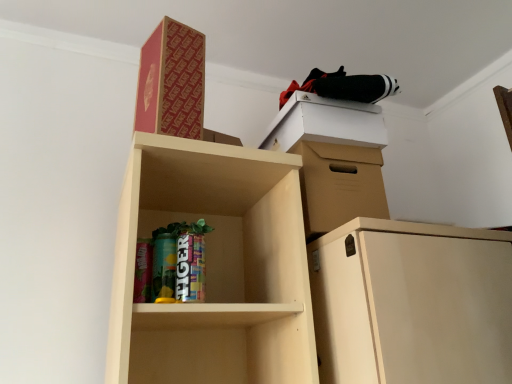
Identify the location of red cardboard box at upper center. (172, 82).

Describe the element at coordinates (172, 82) in the screenshot. The width and height of the screenshot is (512, 384). I see `red cardboard box at upper center` at that location.

You are a GUI agent. You are given a task and a screenshot of the screen. Output one action in this format:
    pyautogui.click(x=<x>, y=<y>)
    Task: Click on the white cardboard box at upper right
    
    Given the screenshot: What is the action you would take?
    pyautogui.click(x=333, y=158)

The image size is (512, 384). Describe the element at coordinates (333, 158) in the screenshot. I see `white cardboard box at upper right` at that location.

Where is `red cardboard box at upper center`? red cardboard box at upper center is located at coordinates (172, 82).

Can you confirm if red cardboard box at upper center is positioned to the right of white cardboard box at upper right?

No, red cardboard box at upper center is not to the right of white cardboard box at upper right.

In the image, is red cardboard box at upper center positioned in front of or behind white cardboard box at upper right?

Clearly, red cardboard box at upper center is in front of white cardboard box at upper right.

Is point (137, 105) positioned before point (300, 95)?

That is True.

From the image's perspective, does red cardboard box at upper center appear lower than white cardboard box at upper right?

Actually, red cardboard box at upper center appears above white cardboard box at upper right in the image.

Based on the photo, from a real-world perspective, is red cardboard box at upper center under white cardboard box at upper right?

No.

Which object is wider, red cardboard box at upper center or white cardboard box at upper right?

white cardboard box at upper right.

Who is shorter, red cardboard box at upper center or white cardboard box at upper right?

white cardboard box at upper right.

Based on the photo, in terms of size, does red cardboard box at upper center appear bigger or smaller than white cardboard box at upper right?

red cardboard box at upper center is smaller than white cardboard box at upper right.

Is red cardboard box at upper center inside or outside of white cardboard box at upper right?

red cardboard box at upper center is not inside white cardboard box at upper right, it's outside.

Is red cardboard box at upper center beside white cardboard box at upper right?

red cardboard box at upper center and white cardboard box at upper right are clearly separated.

Is red cardboard box at upper center looking in the opposite direction of white cardboard box at upper right?

That's not correct — red cardboard box at upper center is not looking away from white cardboard box at upper right.

Where is `paperback book above the white cardboard box at upper right (from a real-world perspective)`? paperback book above the white cardboard box at upper right (from a real-world perspective) is located at coordinates (172, 82).

Based on their positions, is white cardboard box at upper right located to the left or right of red cardboard box at upper center?

white cardboard box at upper right is to the right of red cardboard box at upper center.

Considering their positions, is white cardboard box at upper right located in front of or behind red cardboard box at upper center?

Clearly, white cardboard box at upper right is behind red cardboard box at upper center.

Which is behind, point (376, 202) or point (173, 96)?

The point (376, 202) is more distant.

From the image's perspective, would you say white cardboard box at upper right is shown under red cardboard box at upper center?

Yes.

From a real-world perspective, between white cardboard box at upper right and red cardboard box at upper center, who is vertically higher?

In real-world perspective, red cardboard box at upper center is above.

Which object is thinner, white cardboard box at upper right or red cardboard box at upper center?

Thinner between the two is red cardboard box at upper center.

From the picture: Does white cardboard box at upper right have a greater height compared to red cardboard box at upper center?

Incorrect, the height of white cardboard box at upper right is not larger of that of red cardboard box at upper center.

Considering the sizes of white cardboard box at upper right and red cardboard box at upper center in the image, is white cardboard box at upper right bigger or smaller than red cardboard box at upper center?

white cardboard box at upper right is bigger than red cardboard box at upper center.

Is white cardboard box at upper right situated inside red cardboard box at upper center or outside?

white cardboard box at upper right is spatially situated outside red cardboard box at upper center.

Consider the image. Is white cardboard box at upper right directly adjacent to red cardboard box at upper center?

white cardboard box at upper right is not next to red cardboard box at upper center, and they're not touching.

Could you tell me if white cardboard box at upper right is turned towards red cardboard box at upper center?

No, white cardboard box at upper right is not aimed at red cardboard box at upper center.

This screenshot has height=384, width=512. Find the location of `cabinetry located on the right of red cardboard box at upper center`. cabinetry located on the right of red cardboard box at upper center is located at coordinates (333, 158).

Locate an element on the screen. This screenshot has width=512, height=384. cabinetry behind the red cardboard box at upper center is located at coordinates (333, 158).

The image size is (512, 384). I want to click on cabinetry below the red cardboard box at upper center (from the image's perspective), so click(333, 158).